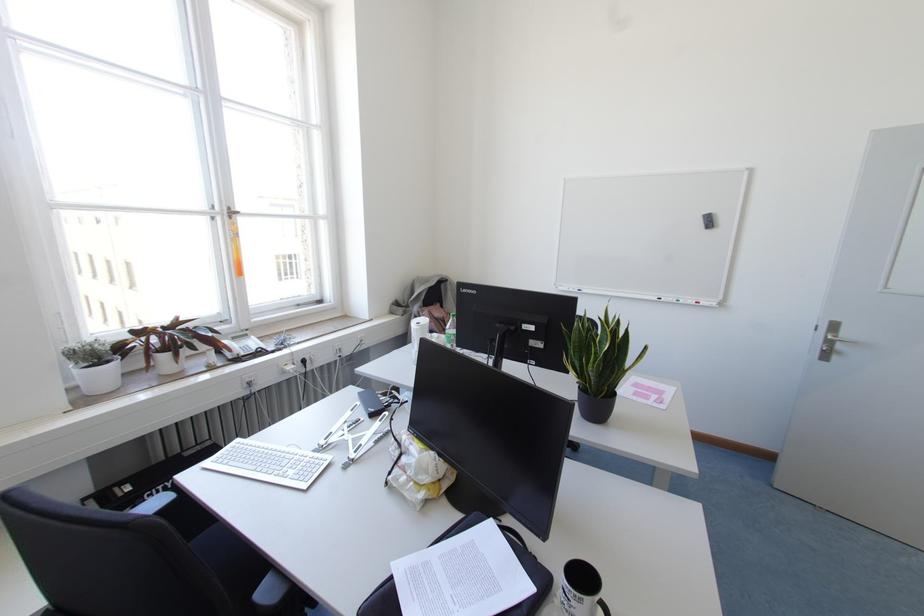
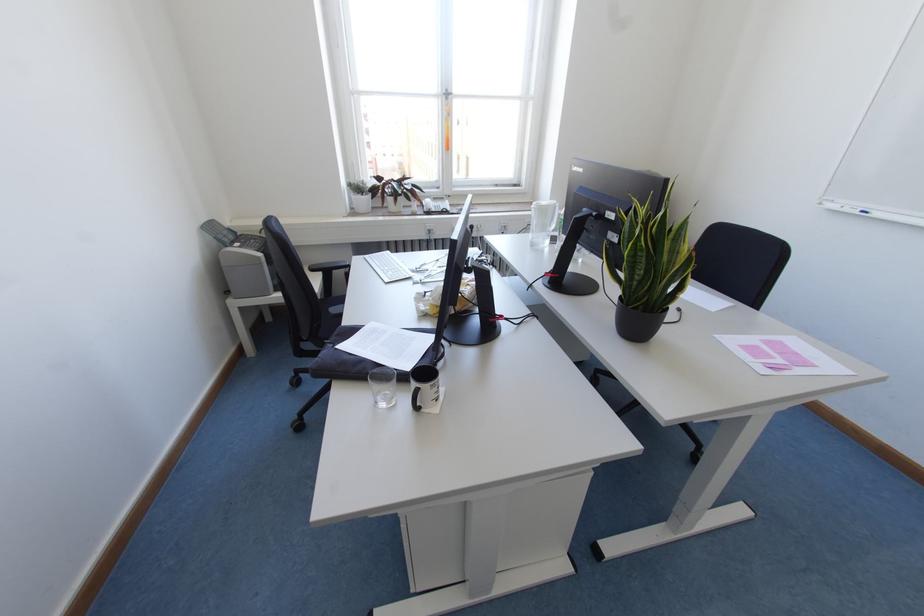
The point at (x=497, y=525) is marked in the first image. Where is the corresponding point in the second image?

(433, 338)